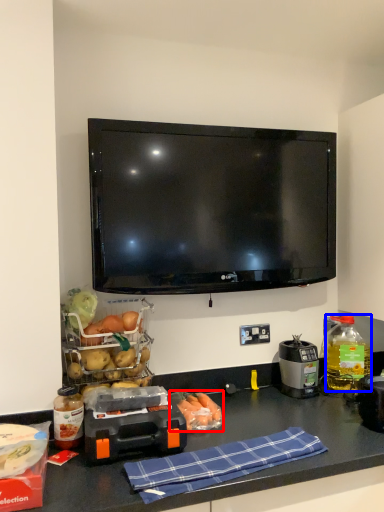
Question: Which point is closer to the camera, food (highlighted by a red box) or bottle (highlighted by a blue box)?

Choices:
 (A) food
 (B) bottle

Answer: (A)